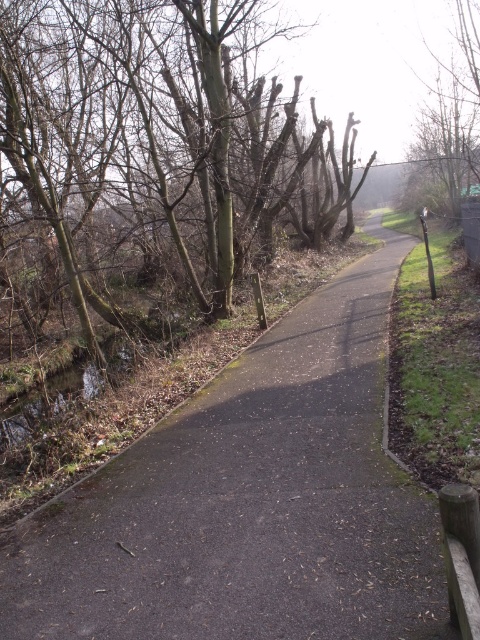
You are a hiker trying to follow the dark asphalt path at center through the trees. There is also a smooth bark tree at upper center nearby. Which one takes up more space in the image?

The smooth bark tree at upper center takes up more space in the image than the dark asphalt path at center because the dark asphalt path at center is smaller than smooth bark tree at upper center.

You are standing on the pathway and want to walk towards the tree with smoother bark. Which tree should you head towards, the smooth bark tree at upper center or the bare wood tree at upper right?

You should head towards the smooth bark tree at upper center because it is closer to the viewer than the bare wood tree at upper right.